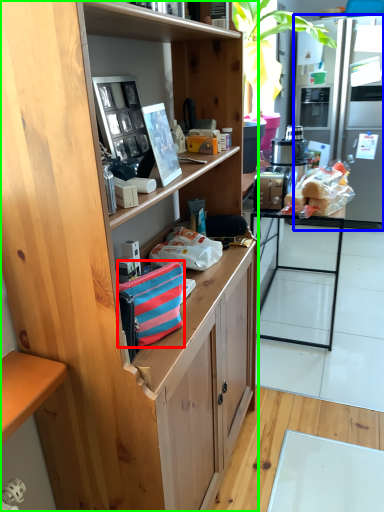
Question: Which object is the closest to the handbag (highlighted by a red box)? Choose among these: refrigerator (highlighted by a blue box) or cabinetry (highlighted by a green box).

Choices:
 (A) refrigerator
 (B) cabinetry

Answer: (B)